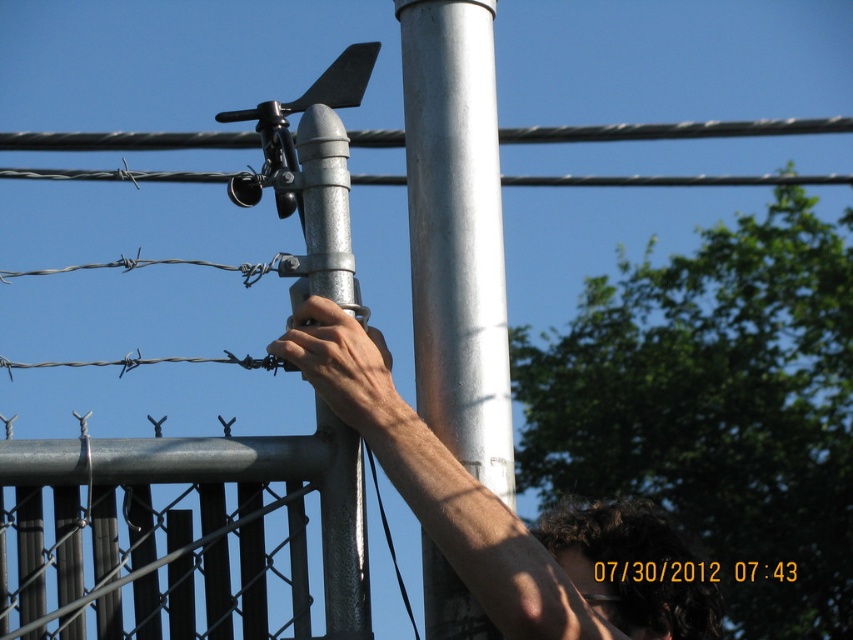
Is silver metallic pole at center in front of galvanized metal pipe at center?

Answer: Yes.

Is silver metallic pole at center behind galvanized metal pipe at center?

No, it is in front of galvanized metal pipe at center.

Which is behind, point (489, 234) or point (299, 266)?

The point (299, 266) is more distant.

Where is `silver metallic pole at center`? silver metallic pole at center is located at coordinates (456, 230).

In the scene shown: Who is shorter, hair at upper center or smooth metallic hand at center?

smooth metallic hand at center is shorter.

Measure the distance between hair at upper center and camera.

hair at upper center and camera are 5.60 meters apart.

This screenshot has height=640, width=853. Identify the location of hair at upper center. (442, 484).

Can you confirm if silver metallic pole at center is shorter than hair at upper center?

No.

Does point (445, 296) come behind point (468, 586)?

Yes, it is behind point (468, 586).

This screenshot has height=640, width=853. I want to click on silver metallic pole at center, so click(x=456, y=230).